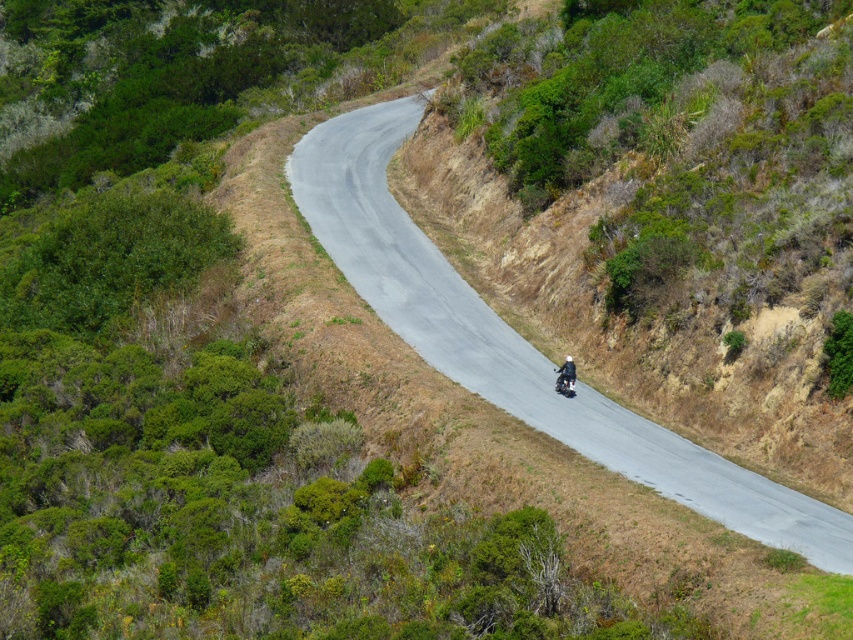
Consider the image. Can you confirm if gray asphalt road at center is positioned below shiny black motorcycle at center?

Actually, gray asphalt road at center is above shiny black motorcycle at center.

Does gray asphalt road at center appear on the left side of shiny black motorcycle at center?

Yes, gray asphalt road at center is to the left of shiny black motorcycle at center.

Locate an element on the screen. This screenshot has width=853, height=640. gray asphalt road at center is located at coordinates (515, 339).